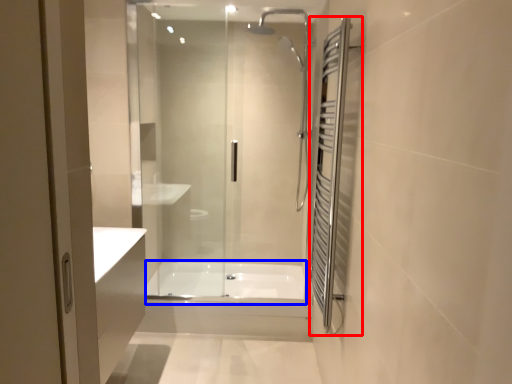
Question: Which object appears closest to the camera in this image, screen door (highlighted by a red box) or bath (highlighted by a blue box)?

Choices:
 (A) screen door
 (B) bath

Answer: (A)